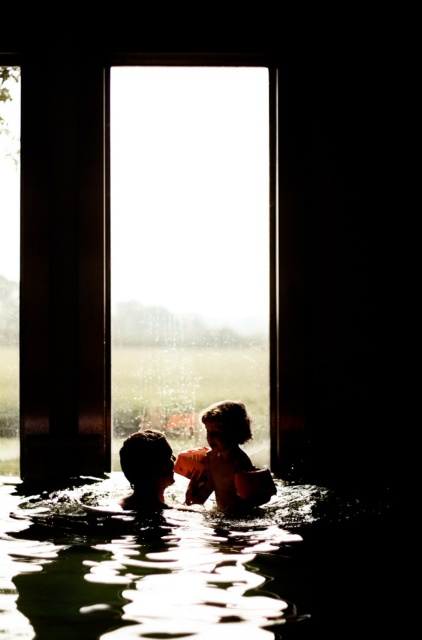
Based on the photo, can you confirm if dark wood pillar at left is positioned to the right of silky brown hair at center?

No, dark wood pillar at left is not to the right of silky brown hair at center.

Is dark wood pillar at left wider than silky brown hair at center?

Correct, the width of dark wood pillar at left exceeds that of silky brown hair at center.

Who is more forward, (105, 433) or (140, 445)?

Positioned in front is point (140, 445).

The height and width of the screenshot is (640, 422). What are the coordinates of `dark wood pillar at left` in the screenshot? It's located at (64, 269).

Who is more forward, (213, 524) or (62, 232)?

Point (213, 524)

How distant is clear liquid water at center from dark wood pillar at left?

clear liquid water at center is 1.46 meters from dark wood pillar at left.

Who is more forward, (x=392, y=540) or (x=35, y=228)?

Positioned in front is point (x=392, y=540).

Locate an element on the screen. The image size is (422, 640). clear liquid water at center is located at coordinates (210, 570).

Who is taller, clear liquid water at center or matte orange life vest at center?

matte orange life vest at center

Is clear liquid water at center to the left of matte orange life vest at center from the viewer's perspective?

Incorrect, clear liquid water at center is not on the left side of matte orange life vest at center.

Which is in front, point (343, 554) or point (183, 460)?

Positioned in front is point (343, 554).

Where is `clear liquid water at center`? Image resolution: width=422 pixels, height=640 pixels. clear liquid water at center is located at coordinates (210, 570).